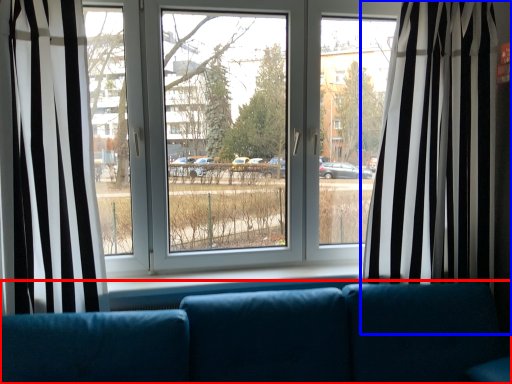
Question: Which object is further to the camera taking this photo, studio couch (highlighted by a red box) or curtain (highlighted by a blue box)?

Choices:
 (A) studio couch
 (B) curtain

Answer: (B)